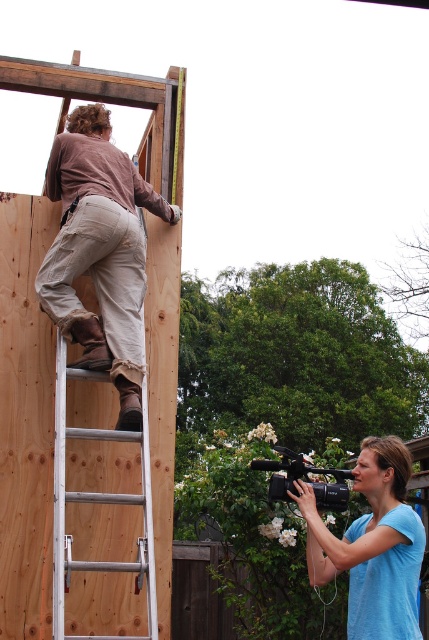
You are a contractor assessing the construction site. You notice the khaki pants at upper left and the silver metallic ladder at left. Which object occupies more space in the image?

The khaki pants at upper left is bigger than the silver metallic ladder at left, so it occupies more space in the image.

You are a construction worker standing at the base of the silver metallic ladder at left and need to reach the khaki pants at upper left. Can you safely climb the ladder without the khaki pants getting in your way?

The khaki pants at upper left might be wider than silver metallic ladder at left, so there is a possibility that they could obstruct your path while climbing. It would be safer to check the clearance before attempting to climb.

You are a construction worker standing at the origin point of the coordinate system. You need to place a tool exactly at the location of the khaki pants at upper left. What are the coordinates where you should place the tool?

The coordinates for the khaki pants at upper left are at point (x=99, y=252).